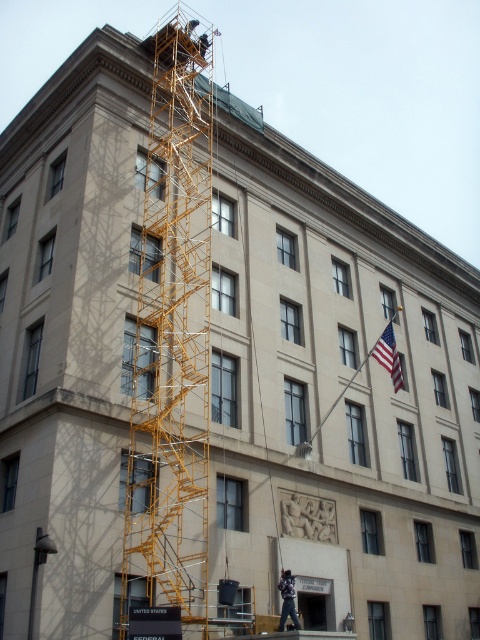
Between american flag at upper right and dark blue jeans at lower center, which one is positioned higher?

american flag at upper right is higher up.

Is american flag at upper right closer to camera compared to dark blue jeans at lower center?

No, american flag at upper right is behind dark blue jeans at lower center.

Does point (386, 365) come behind point (288, 611)?

Yes, point (386, 365) is behind point (288, 611).

Locate an element on the screen. This screenshot has width=480, height=640. american flag at upper right is located at coordinates (388, 355).

Who is positioned more to the right, yellow metal scaffolding at upper left or american flag at upper right?

american flag at upper right is more to the right.

Between point (197, 477) and point (402, 371), which one is positioned in front?

Point (197, 477) is in front.

Does point (186, 300) come in front of point (394, 316)?

Yes, it is.

Identify the location of yellow metal scaffolding at upper left. The width and height of the screenshot is (480, 640). (172, 336).

What do you see at coordinates (172, 336) in the screenshot? The image size is (480, 640). I see `yellow metal scaffolding at upper left` at bounding box center [172, 336].

Does yellow metal scaffolding at upper left have a greater height compared to dark blue jeans at lower center?

Yes.

Does point (144, 298) lie in front of point (291, 593)?

No, (144, 298) is behind (291, 593).

Locate an element on the screen. This screenshot has width=480, height=640. yellow metal scaffolding at upper left is located at coordinates pos(172,336).